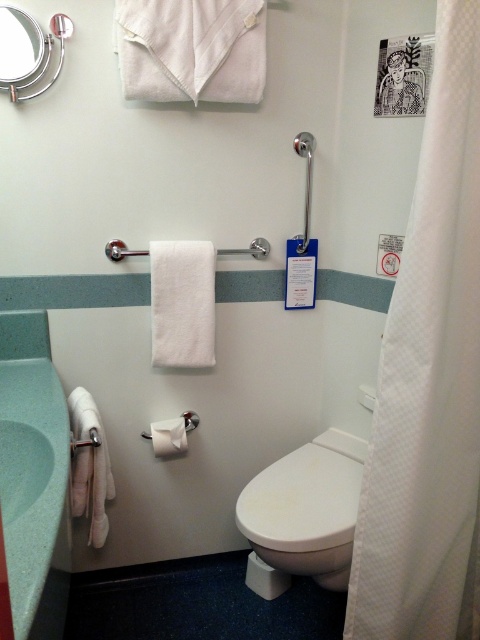
Does white cotton bath towel at upper center have a smaller size compared to white matte toilet paper at lower center?

No, white cotton bath towel at upper center is not smaller than white matte toilet paper at lower center.

I want to click on white cotton bath towel at upper center, so click(192, 49).

In the scene shown: Is white glossy toilet at center shorter than satin silver grab bar at upper center?

Incorrect, white glossy toilet at center's height does not fall short of satin silver grab bar at upper center's.

Is white glossy toilet at center in front of satin silver grab bar at upper center?

Yes, white glossy toilet at center is closer to the viewer.

Identify the location of white glossy toilet at center. (305, 509).

Based on the photo, who is shorter, white cotton bath towel at upper center or satin silver grab bar at upper center?

Standing shorter between the two is white cotton bath towel at upper center.

Who is more distant from viewer, (156, 61) or (309, 186)?

The point (309, 186) is more distant.

This screenshot has width=480, height=640. What are the coordinates of `white cotton bath towel at upper center` in the screenshot? It's located at (192, 49).